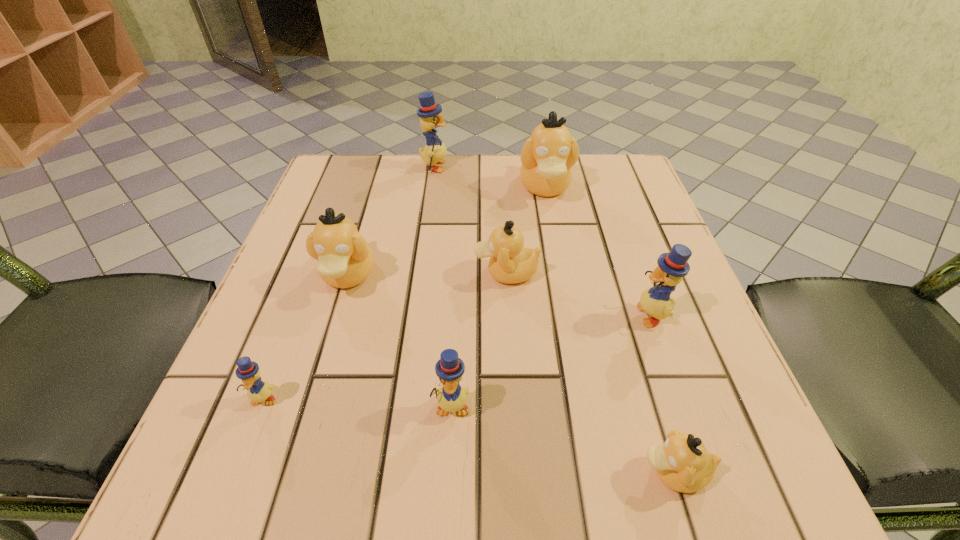
Identify the location of free space between the fourth duckling from left to right and the leftmost yellow duckling. (357, 402).

Identify the location of unoccupied position between the biggest tan duckling and the smallest yellow duckling. (404, 293).

This screenshot has width=960, height=540. In order to click on free point between the third biggest tan duckling and the second biggest yellow duckling in this screenshot , I will do `click(579, 293)`.

You are a GUI agent. You are given a task and a screenshot of the screen. Output one action in this format:
    pyautogui.click(x=<x>, y=<y>)
    Task: Click on the blank region between the second biggest yellow duckling and the third yellow duckling from left to right
    
    Given the screenshot: What is the action you would take?
    pyautogui.click(x=551, y=360)

The height and width of the screenshot is (540, 960). Identify the location of object that can be found as the seventh closest to the second biggest yellow duckling. (259, 390).

Identify which object is the fifth closest to the second smallest yellow duckling. Please provide its 2D coordinates. Your answer should be formatted as a tuple, i.e. [(x, y)], where the tuple contains the x and y coordinates of a point satisfying the conditions above.

[(673, 266)]

Identify which duckling is the fourth closest to the third nearest yellow duckling. Please provide its 2D coordinates. Your answer should be formatted as a tuple, i.e. [(x, y)], where the tuple contains the x and y coordinates of a point satisfying the conditions above.

[(452, 397)]

Locate which duckling ranks seventh in proximity to the nearest duckling. Please provide its 2D coordinates. Your answer should be formatted as a tuple, i.e. [(x, y)], where the tuple contains the x and y coordinates of a point satisfying the conditions above.

[(434, 152)]

Locate which yellow duckling is the fourth closest to the third biggest tan duckling. Please provide its 2D coordinates. Your answer should be formatted as a tuple, i.e. [(x, y)], where the tuple contains the x and y coordinates of a point satisfying the conditions above.

[(259, 390)]

Locate which yellow duckling is the third closest to the smallest yellow duckling. Please provide its 2D coordinates. Your answer should be formatted as a tuple, i.e. [(x, y)], where the tuple contains the x and y coordinates of a point satisfying the conditions above.

[(434, 152)]